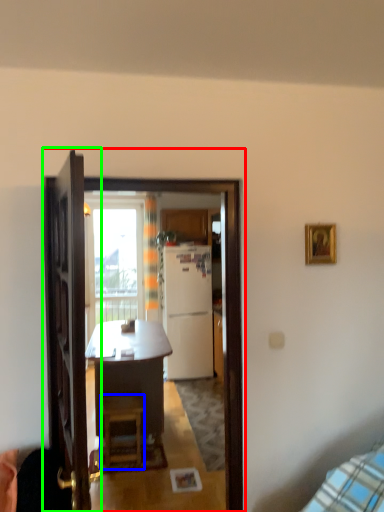
Question: Considering the real-world distances, which object is farthest from screen door (highlighted by a red box)? stool (highlighted by a blue box) or door (highlighted by a green box)?

Choices:
 (A) stool
 (B) door

Answer: (A)